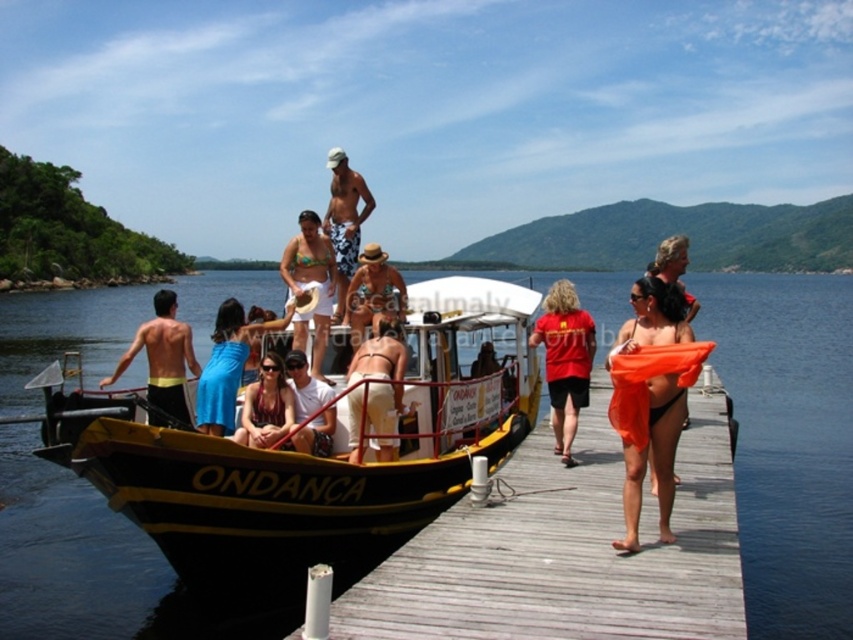
You are a photographer standing on the wooden pier and want to capture a photo of the beige fabric hat at center and the white cotton shirt at center. Which object should you zoom in more on to ensure both are clearly visible in the frame?

Since the beige fabric hat at center is larger in size compared to the white cotton shirt at center, you should zoom in more on the white cotton shirt at center to ensure both are clearly visible in the frame.

You are a photographer standing on the wooden pier and want to take a photo of the beige fabric hat at center and the white cotton shirt at center. Which object should you focus on first if you want to capture both in the same frame without moving the camera?

The beige fabric hat at center is much taller than the white cotton shirt at center, so you should focus on the beige fabric hat at center first to ensure it fits within the frame.

You are standing on the wooden dock at lower right and want to reach the black matte shorts at left. According to the scene, which direction should you move to get there?

The wooden dock at lower right is located below the black matte shorts at left, so you should move upward to reach the black matte shorts at left.